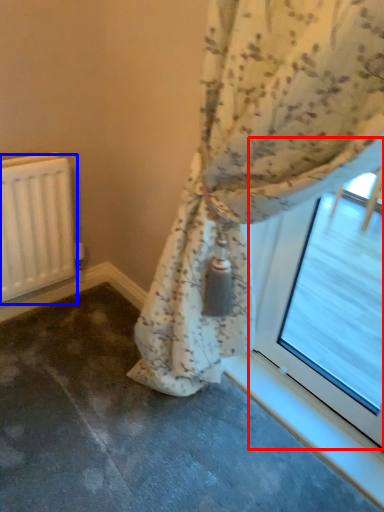
Question: Among these objects, which one is nearest to the camera, bay window (highlighted by a red box) or radiator (highlighted by a blue box)?

Choices:
 (A) bay window
 (B) radiator

Answer: (A)